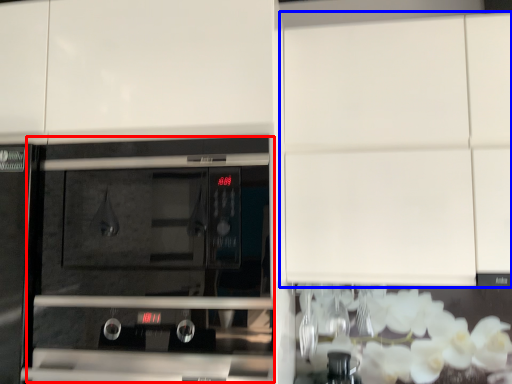
Question: Which of the following is the closest to the observer, oven (highlighted by a red box) or cabinetry (highlighted by a blue box)?

Choices:
 (A) oven
 (B) cabinetry

Answer: (A)